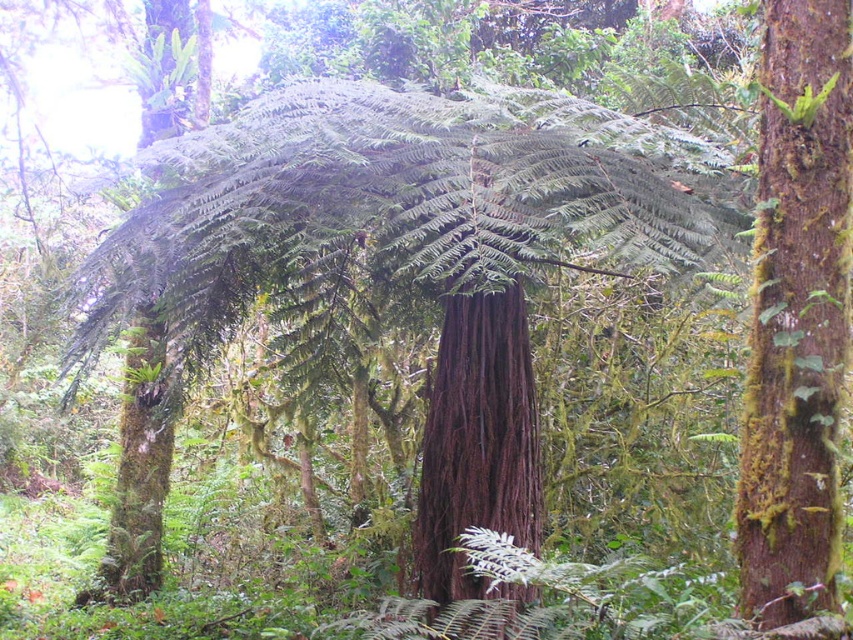
Between brown rough bark at right and dark brown wood at center, which one has less height?

With less height is dark brown wood at center.

Between point (763, 598) and point (485, 301), which one is positioned behind?

Point (485, 301)

Which is behind, point (764, 77) or point (518, 424)?

Positioned behind is point (518, 424).

I want to click on brown rough bark at right, so click(798, 314).